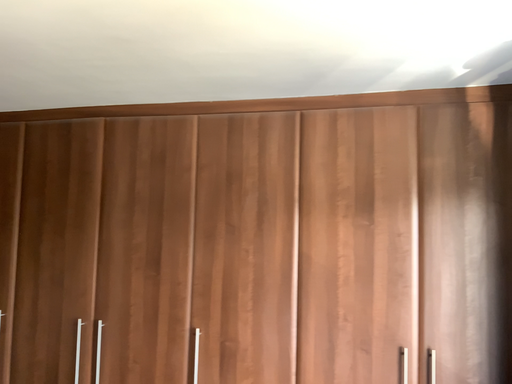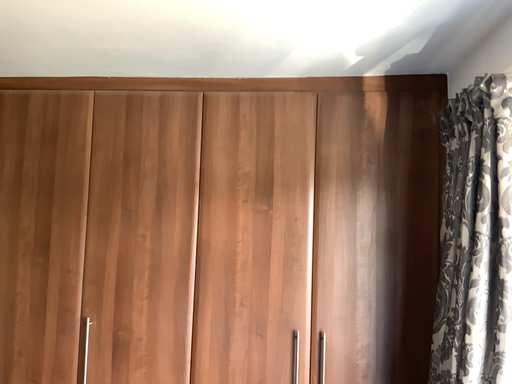
Question: Which way did the camera rotate in the video?

Choices:
 (A) rotated left
 (B) rotated right

Answer: (B)